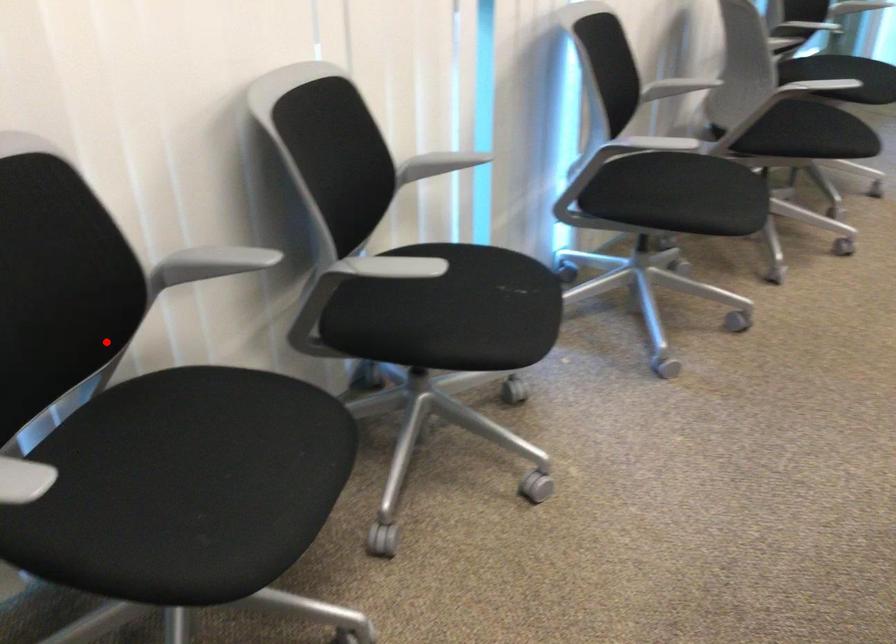
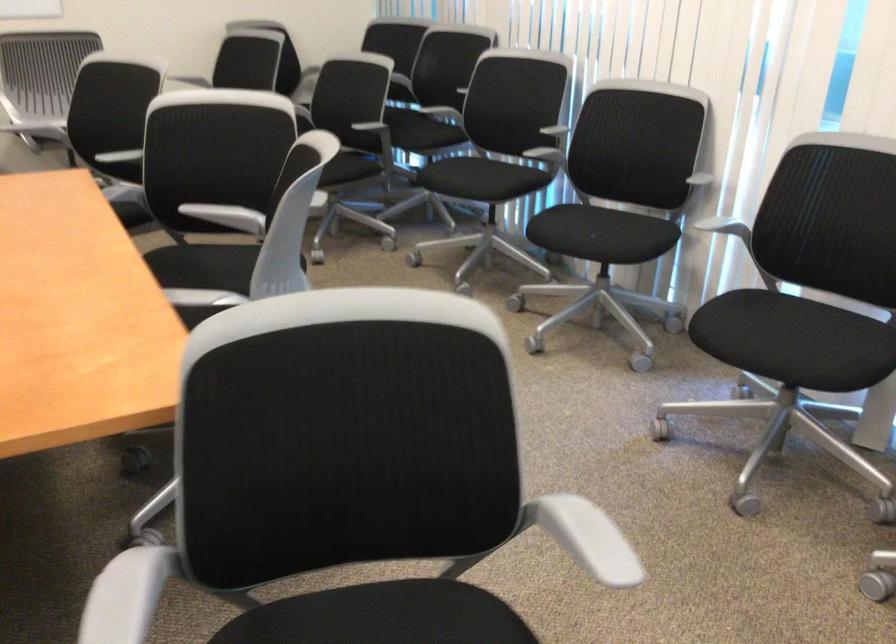
Find the pixel in the second image that matches the highlighted location in the first image.

(543, 146)